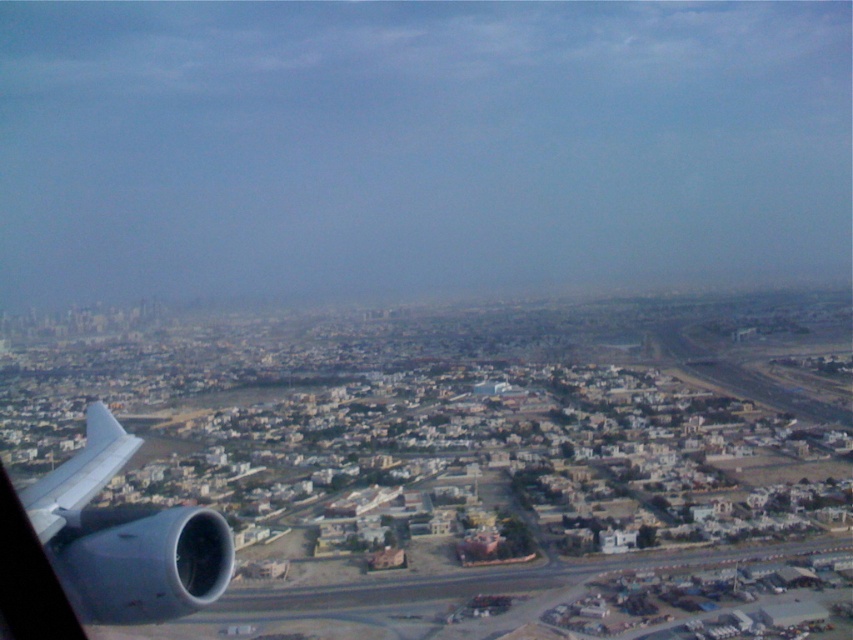
Who is more distant from viewer, [200,536] or [102,477]?

The point [102,477] is more distant.

Is point (76, 611) less distant than point (102, 468)?

No, (76, 611) is behind (102, 468).

Where is `metallic gray engine at bottom left`? metallic gray engine at bottom left is located at coordinates [125, 538].